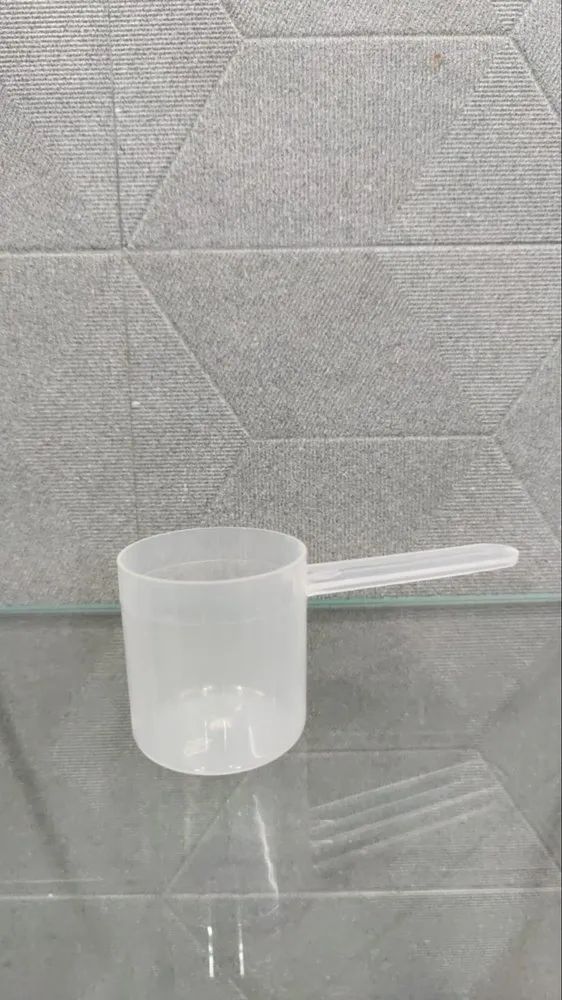
Locate an element on the screen. counter top is located at coordinates (407, 768).